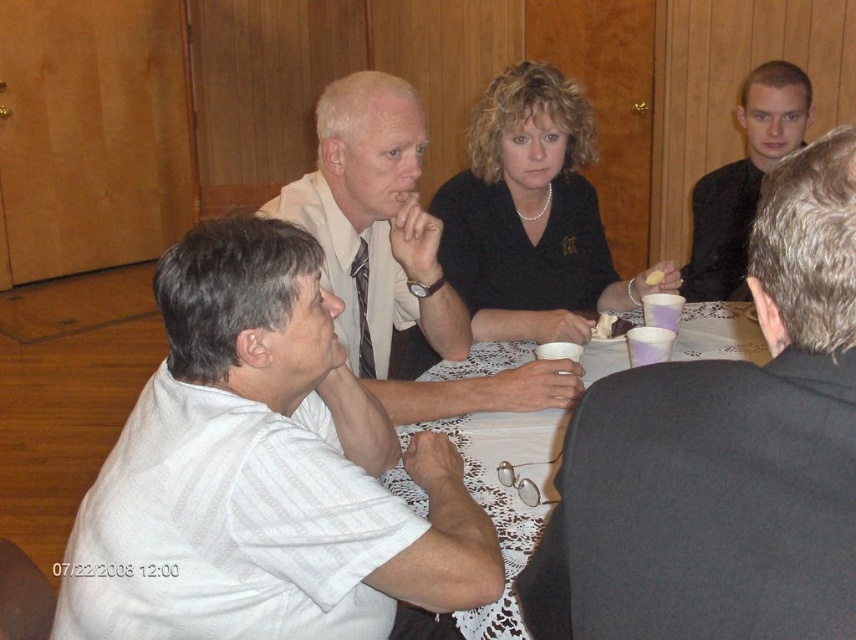
Question: Which point is farther from the camera taking this photo?

Choices:
 (A) (354, 172)
 (B) (750, 502)
 (C) (470, 307)

Answer: (C)

Question: Can you confirm if white striped shirt at center is positioned below white lace tablecloth at center?

Choices:
 (A) yes
 (B) no

Answer: (A)

Question: Among these points, which one is farthest from the camera?

Choices:
 (A) (512, 276)
 (B) (299, 189)

Answer: (A)

Question: From the image, what is the correct spatial relationship of white lace tablecloth at center in relation to black smooth shirt at upper right?

Choices:
 (A) above
 (B) below

Answer: (B)

Question: Is dark gray suit at upper right above white lace tablecloth at center?

Choices:
 (A) yes
 (B) no

Answer: (A)

Question: Among these objects, which one is nearest to the camera?

Choices:
 (A) dark gray suit at upper right
 (B) white striped shirt at center

Answer: (A)